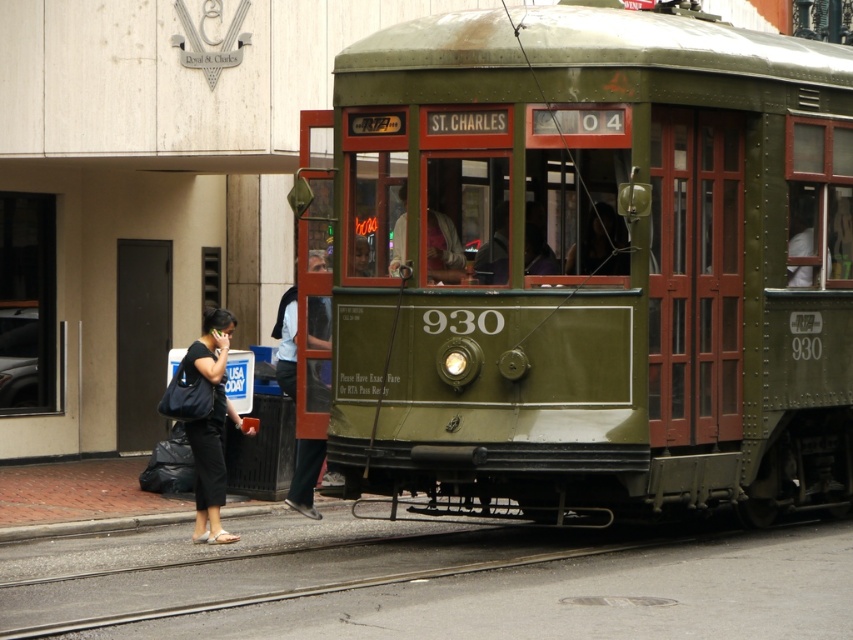
You are standing at the point labeled as point (x=433, y=580) in the image. What object are you standing on?

You are standing on the black asphalt train track at lower center.

From the picture: You are standing at the intersection of St. Charles Avenue and Lee Circle. You see the green metal train car at center. Based on its coordinates, can you determine if it is positioned closer to the tracks or the sidewalk?

The green metal train car at center is located at point coordinates, so it is positioned closer to the tracks than the sidewalk.

You are standing on the sidewalk next to the St. Charles streetcar. There are two points marked on the image. Which point, point (717, 301) or point (312, 512), is closer to you?

Point (717, 301) is closer to the viewer than point (312, 512).